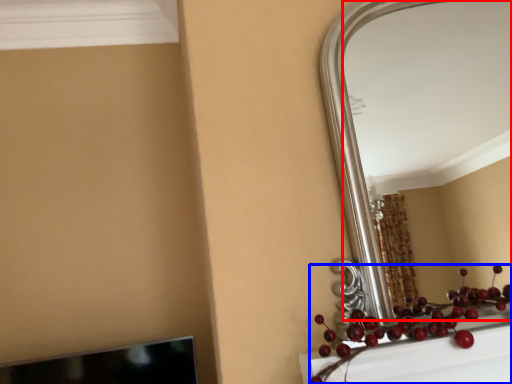
Question: Which of the following is the farthest to the observer, mirror (highlighted by a red box) or fruit (highlighted by a blue box)?

Choices:
 (A) mirror
 (B) fruit

Answer: (A)